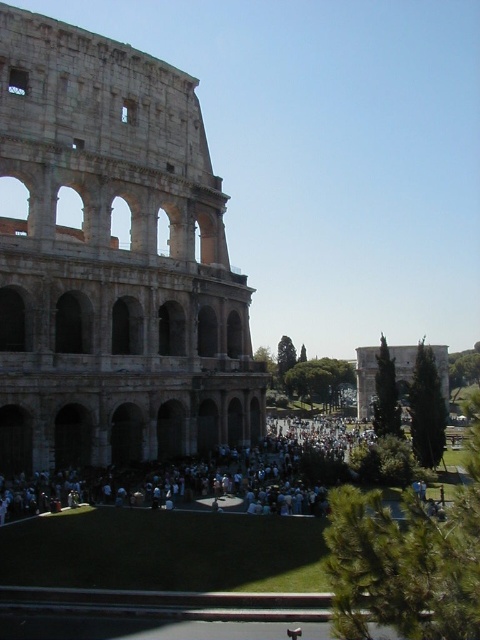
Question: Does stone amphitheater at left have a smaller size compared to white cloth crowd at center?

Choices:
 (A) yes
 (B) no

Answer: (B)

Question: Which point appears closest to the camera in this image?

Choices:
 (A) (105, 259)
 (B) (151, 497)

Answer: (A)

Question: Which of the following is the closest to the observer?

Choices:
 (A) stone amphitheater at left
 (B) white cloth crowd at center

Answer: (A)

Question: Can you confirm if stone amphitheater at left is positioned below white cloth crowd at center?

Choices:
 (A) no
 (B) yes

Answer: (A)

Question: Is stone amphitheater at left behind white cloth crowd at center?

Choices:
 (A) yes
 (B) no

Answer: (B)